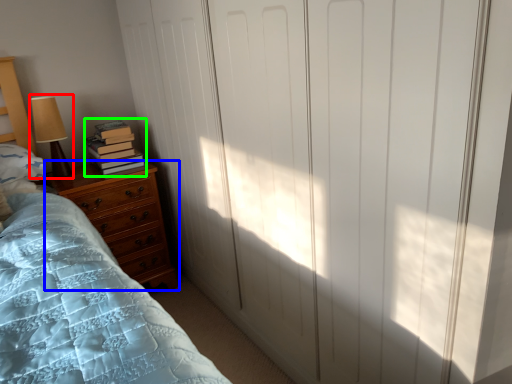
Question: Which object is positioned closest to table lamp (highlighted by a red box)? Select from chest of drawers (highlighted by a blue box) and book (highlighted by a green box).

Choices:
 (A) chest of drawers
 (B) book

Answer: (B)